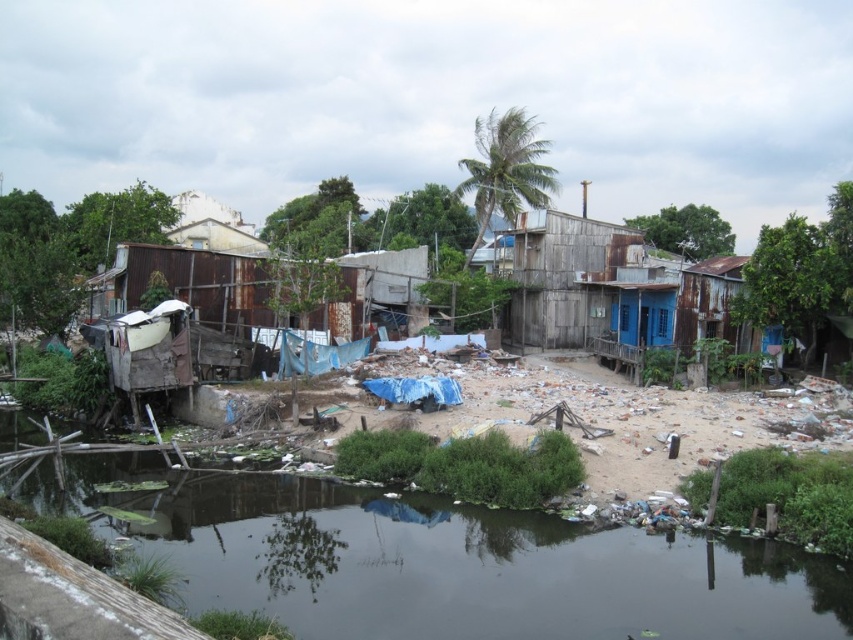
You are a delivery drone that needs to fly from the dark green water at lower center to the rusty wood shack at center. Which direction should you fly to reach your destination?

The dark green water at lower center is to the left of rusty wood shack at center, so you should fly to the right to reach the rusty wood shack at center from the dark green water at lower center.